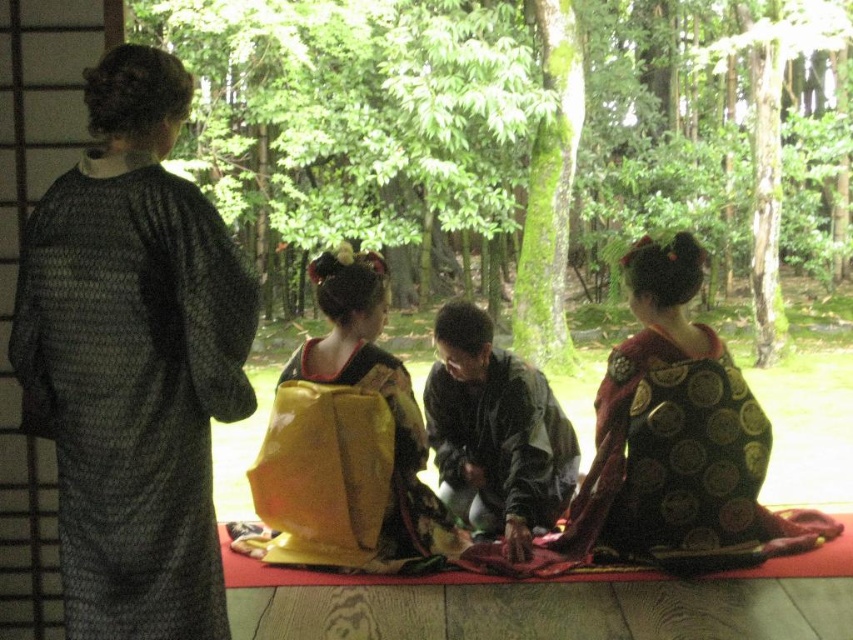
Question: Is black textured robe at left to the left of dark green fabric at center from the viewer's perspective?

Choices:
 (A) yes
 (B) no

Answer: (A)

Question: Does black textured robe at left appear over yellow satin kimono at center?

Choices:
 (A) yes
 (B) no

Answer: (A)

Question: Among these points, which one is nearest to the camera?

Choices:
 (A) (373, 548)
 (B) (737, 524)

Answer: (B)

Question: Does black silk kimono at center come in front of dark green fabric at center?

Choices:
 (A) yes
 (B) no

Answer: (A)

Question: Which point is closer to the camera?

Choices:
 (A) dark green fabric at center
 (B) yellow satin kimono at center

Answer: (B)

Question: Among these points, which one is nearest to the camera?

Choices:
 (A) pyautogui.click(x=202, y=385)
 (B) pyautogui.click(x=712, y=532)
 (C) pyautogui.click(x=570, y=460)

Answer: (A)